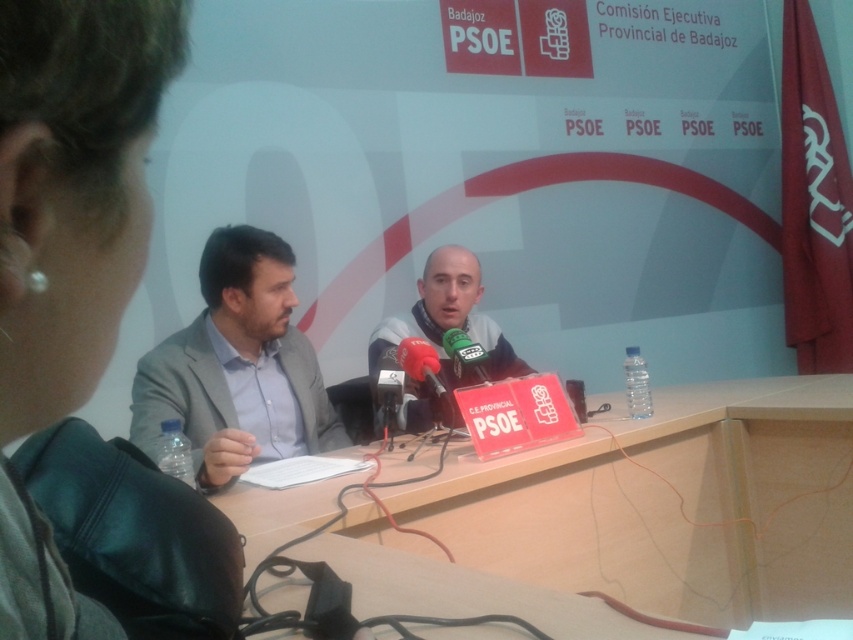
Question: Which of the following is the farthest from the observer?

Choices:
 (A) green matte microphone at center
 (B) metallic red microphone at center
 (C) light brown wood table at center
 (D) gray fabric suit at left

Answer: (A)

Question: Which point is farther to the camera?

Choices:
 (A) (256, 380)
 (B) (467, 362)

Answer: (A)

Question: Observing the image, what is the correct spatial positioning of light brown wood table at center in reference to gray fabric suit at left?

Choices:
 (A) right
 (B) left

Answer: (A)

Question: Can you confirm if light brown wood table at center is thinner than matte black microphone at center?

Choices:
 (A) yes
 (B) no

Answer: (B)

Question: Can you confirm if gray fabric suit at left is bigger than metallic red microphone at center?

Choices:
 (A) no
 (B) yes

Answer: (B)

Question: Which object is closer to the camera taking this photo?

Choices:
 (A) metallic red microphone at center
 (B) gray fabric suit at left

Answer: (B)